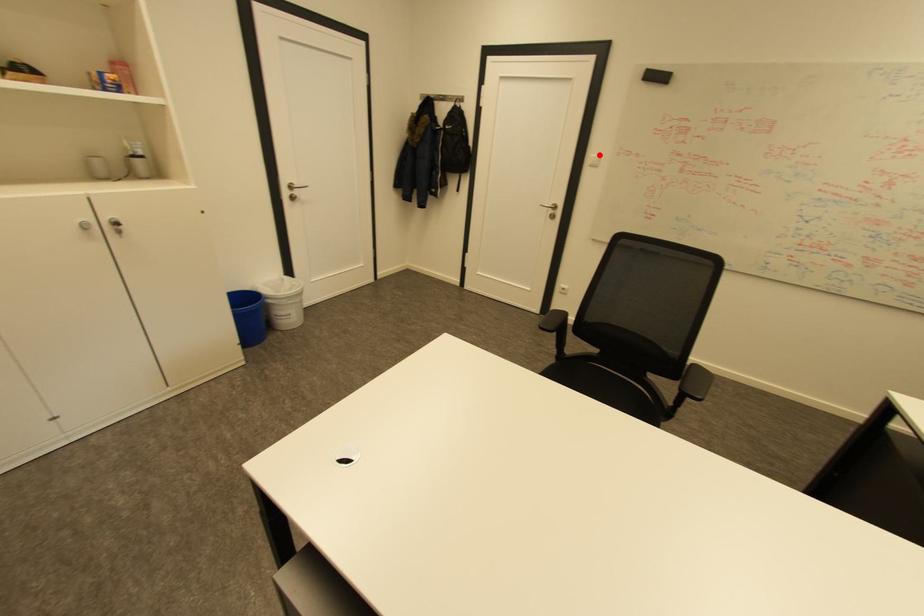
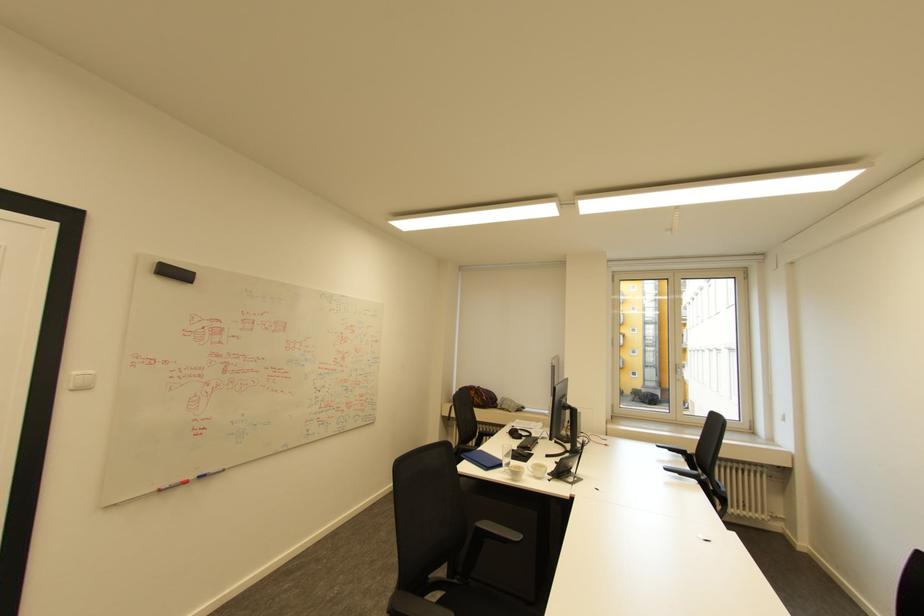
Where in the second image is the point corresponding to the highlighted location from the first image?

(79, 371)